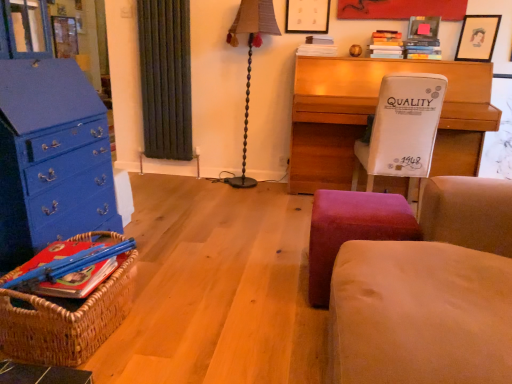
At what (x,y) coordinates should I click in order to perform the action: click on free space in front of brown fabric lampshade at center. Please return your answer as a coordinate pair (x, y). The width and height of the screenshot is (512, 384). Looking at the image, I should click on (253, 199).